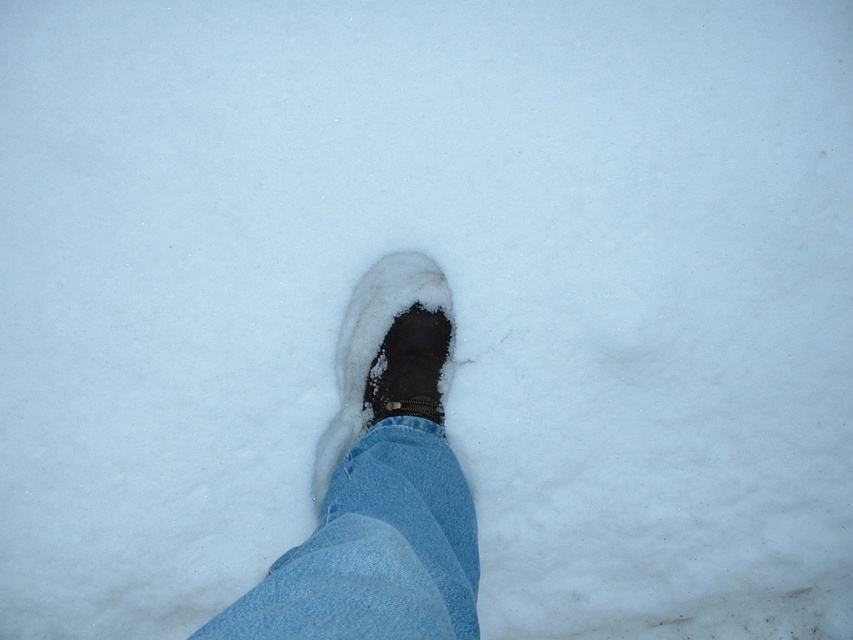
The height and width of the screenshot is (640, 853). I want to click on denim at center, so click(374, 552).

Who is shorter, denim at center or brown suede boot at center?

Standing shorter between the two is denim at center.

Who is more forward, (387, 556) or (376, 323)?

Point (387, 556) is more forward.

Find the location of `denim at center`. denim at center is located at coordinates (374, 552).